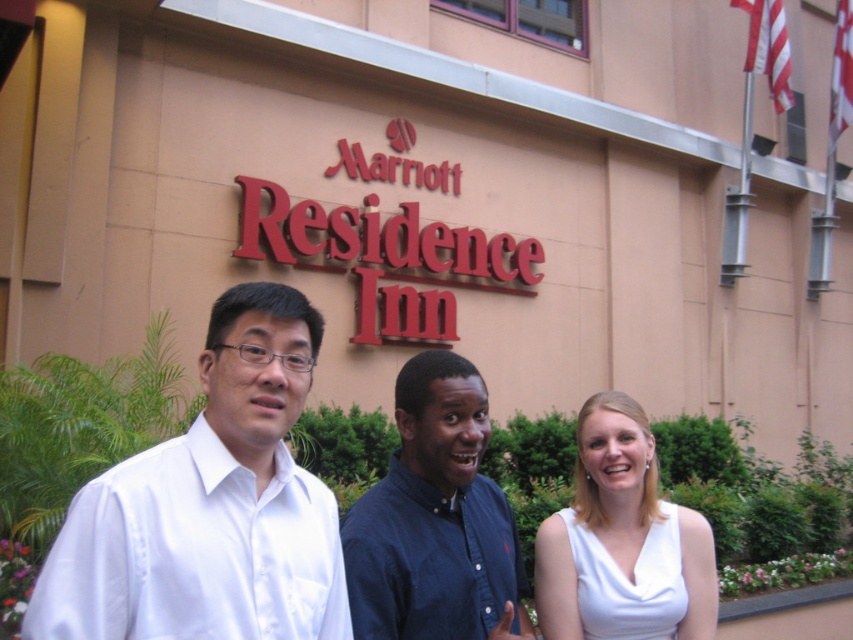
Can you confirm if white satin shirt at center is shorter than blue button-down shirt at center?

Correct, white satin shirt at center is not as tall as blue button-down shirt at center.

Who is higher up, white satin shirt at center or blue button-down shirt at center?

white satin shirt at center is above.

Find the location of `white satin shirt at center`. white satin shirt at center is located at coordinates (210, 506).

Does blue button-down shirt at center appear on the left side of white matte dress at center?

Yes, blue button-down shirt at center is to the left of white matte dress at center.

Which of these two, blue button-down shirt at center or white matte dress at center, stands shorter?

white matte dress at center

Which is in front, point (451, 352) or point (555, 577)?

Point (555, 577)

Image resolution: width=853 pixels, height=640 pixels. I want to click on blue button-down shirt at center, so 434,520.

Between white satin shirt at center and white matte dress at center, which one is positioned lower?

white matte dress at center is below.

From the picture: Between white satin shirt at center and white matte dress at center, which one appears on the left side from the viewer's perspective?

white satin shirt at center

The width and height of the screenshot is (853, 640). In order to click on white satin shirt at center in this screenshot , I will do click(210, 506).